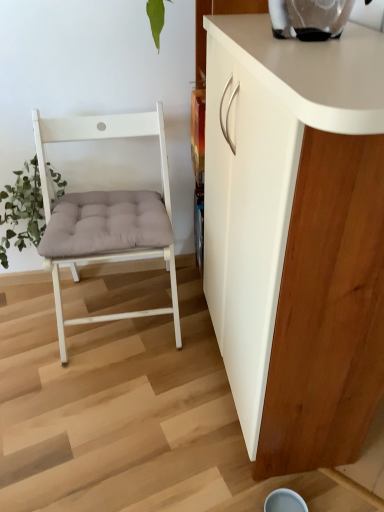
Question: Does white wood chair at left come in front of green fuzzy plant at left?

Choices:
 (A) no
 (B) yes

Answer: (B)

Question: Would you consider white wood chair at left to be distant from green fuzzy plant at left?

Choices:
 (A) yes
 (B) no

Answer: (B)

Question: Does white wood chair at left have a greater width compared to green fuzzy plant at left?

Choices:
 (A) yes
 (B) no

Answer: (A)

Question: Considering the relative sizes of white wood chair at left and green fuzzy plant at left in the image provided, is white wood chair at left shorter than green fuzzy plant at left?

Choices:
 (A) yes
 (B) no

Answer: (B)

Question: Does white wood chair at left have a smaller size compared to green fuzzy plant at left?

Choices:
 (A) no
 (B) yes

Answer: (A)

Question: Considering the relative sizes of white wood chair at left and green fuzzy plant at left in the image provided, is white wood chair at left thinner than green fuzzy plant at left?

Choices:
 (A) no
 (B) yes

Answer: (A)

Question: From a real-world perspective, is green fuzzy plant at left physically above white wood chair at left?

Choices:
 (A) yes
 (B) no

Answer: (B)

Question: Is green fuzzy plant at left bigger than white wood chair at left?

Choices:
 (A) yes
 (B) no

Answer: (B)

Question: Could you tell me if green fuzzy plant at left is turned towards white wood chair at left?

Choices:
 (A) yes
 (B) no

Answer: (B)

Question: Is green fuzzy plant at left further to camera compared to white wood chair at left?

Choices:
 (A) yes
 (B) no

Answer: (A)

Question: Does green fuzzy plant at left have a smaller size compared to white wood chair at left?

Choices:
 (A) no
 (B) yes

Answer: (B)

Question: Considering the relative sizes of green fuzzy plant at left and white wood chair at left in the image provided, is green fuzzy plant at left thinner than white wood chair at left?

Choices:
 (A) no
 (B) yes

Answer: (B)

Question: Would you say white matte cabinet at right is outside green fuzzy plant at left?

Choices:
 (A) no
 (B) yes

Answer: (B)